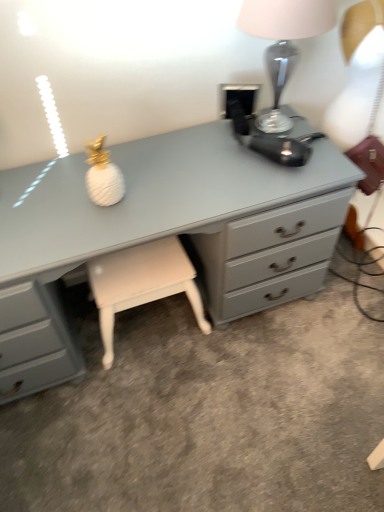
The image size is (384, 512). What are the coordinates of `free space in front of satin silver lamp at upper right` in the screenshot? It's located at (259, 183).